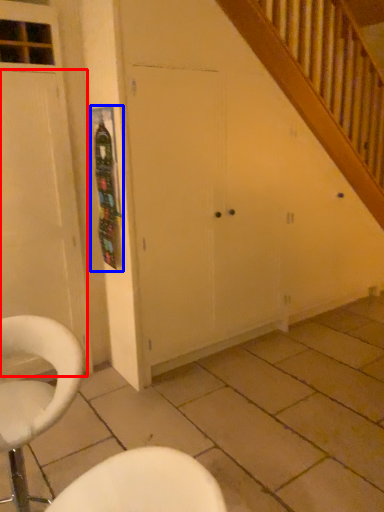
Question: Which of the following is the closest to the observer, door (highlighted by a red box) or bulletin board (highlighted by a blue box)?

Choices:
 (A) door
 (B) bulletin board

Answer: (A)